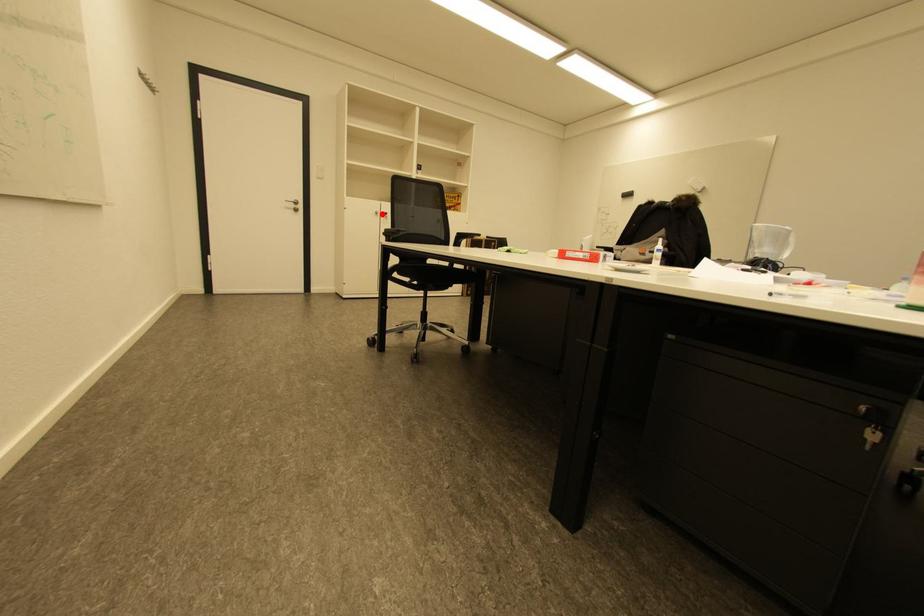
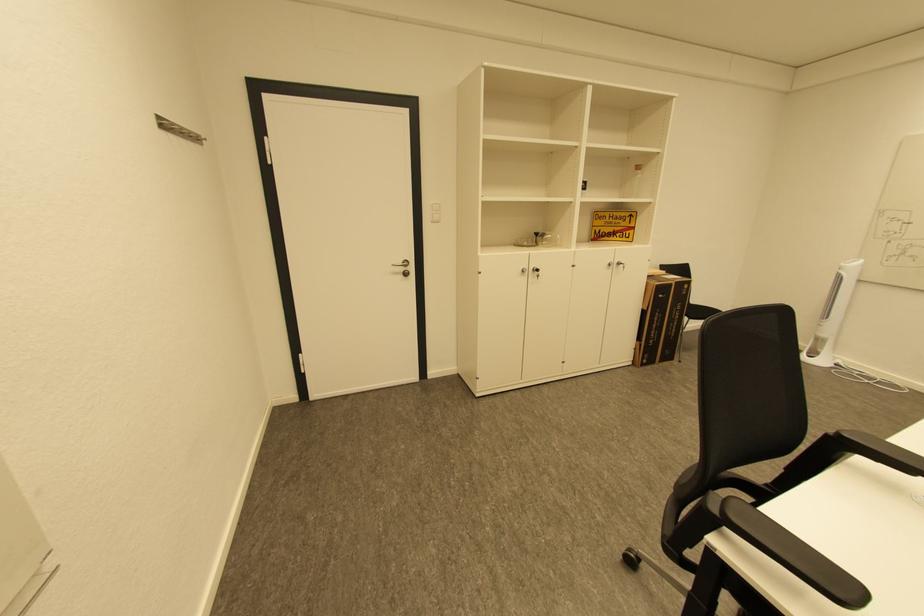
Question: I am providing you with two images of the same scene from different viewpoints. A red point is marked on the first image. Is the red point's position out of view in image 2?

Choices:
 (A) Yes
 (B) No

Answer: (B)